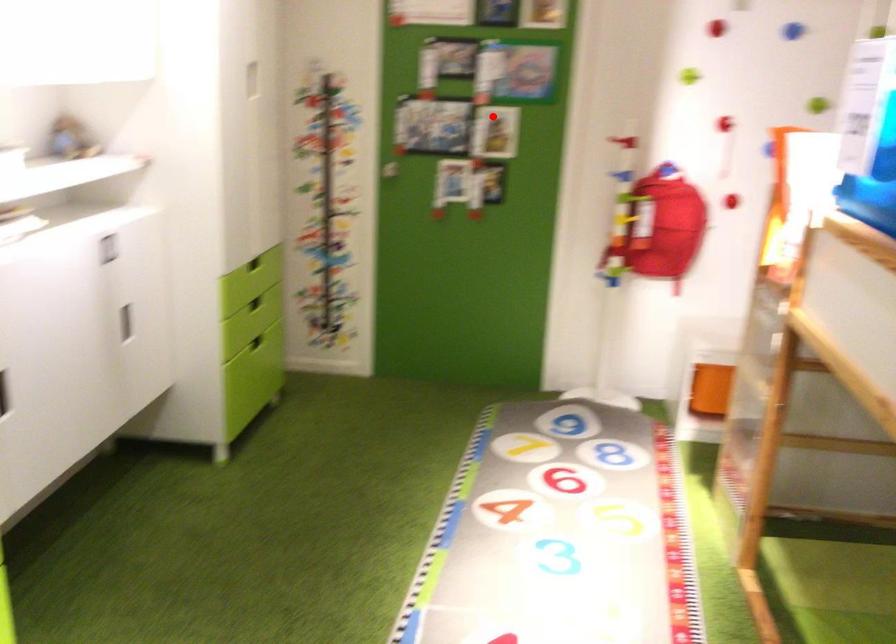
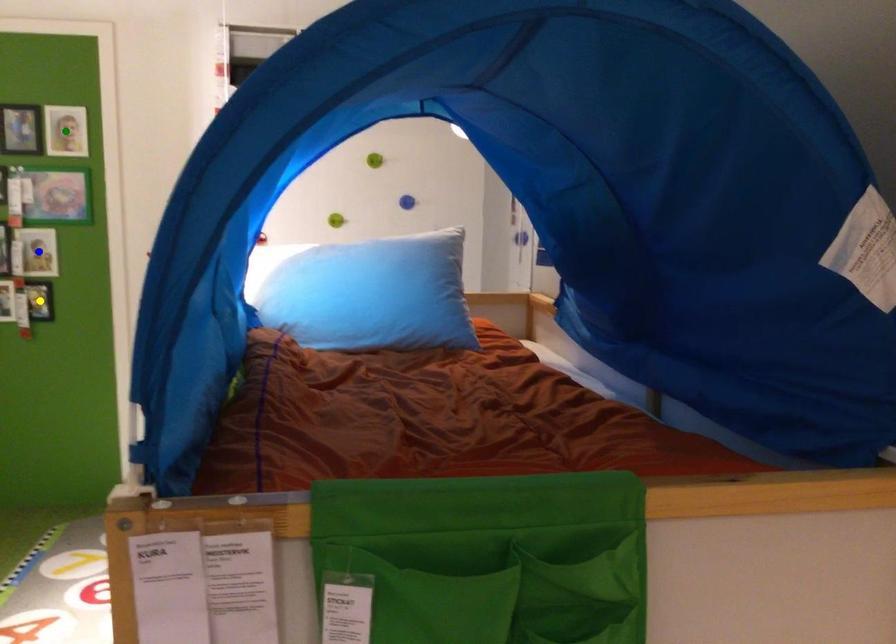
Question: I am providing you with two images of the same scene from different viewpoints. A red point is marked on the first image. You are given multiple points on the second image. Can you choose the point in image 2 that corresponds to the point in image 1?

Choices:
 (A) yellow point
 (B) green point
 (C) blue point

Answer: (C)